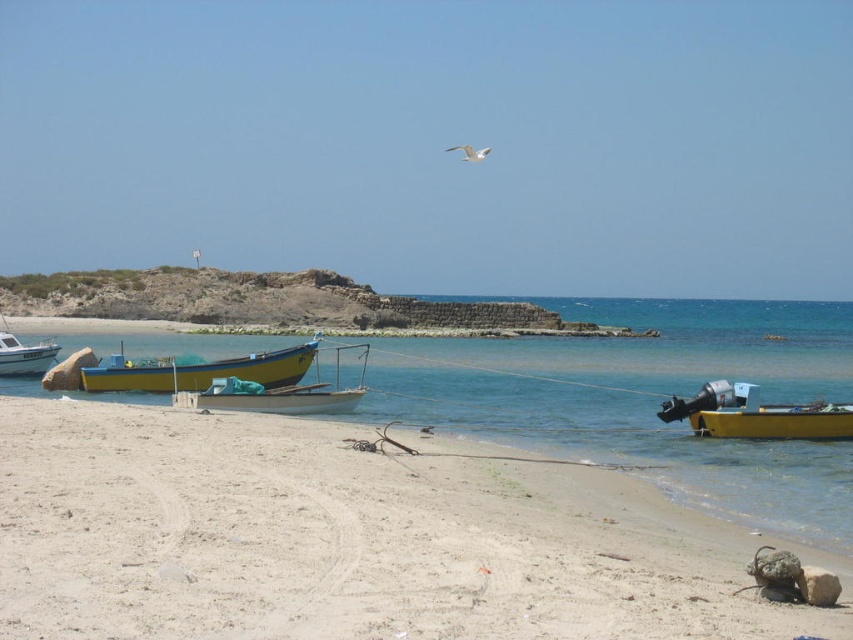
Looking at this image, does yellow matte boat at lower right appear on the right side of yellow matte boat at left?

Yes, yellow matte boat at lower right is to the right of yellow matte boat at left.

I want to click on yellow matte boat at lower right, so click(755, 413).

The image size is (853, 640). I want to click on yellow matte boat at lower right, so click(x=755, y=413).

Is point (184, 388) positioned before point (4, 342)?

That is True.

You are a GUI agent. You are given a task and a screenshot of the screen. Output one action in this format:
    pyautogui.click(x=<x>, y=<y>)
    Task: Click on the yellow matte boat at left
    This screenshot has width=853, height=640.
    Given the screenshot: What is the action you would take?
    pyautogui.click(x=200, y=371)

Does white sandy beach at lower left have a smaller size compared to white glossy boat at left?

Yes.

Where is `white sandy beach at lower left`? white sandy beach at lower left is located at coordinates (347, 538).

Is point (476, 524) closer to camera compared to point (6, 342)?

Yes, point (476, 524) is closer to viewer.

The image size is (853, 640). I want to click on white sandy beach at lower left, so click(x=347, y=538).